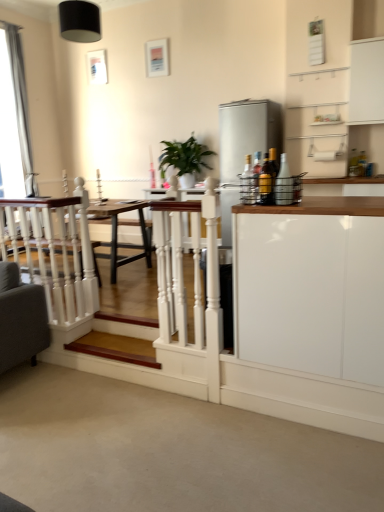
Question: Does satin silver refrigerator at right have a greater height compared to green glossy plant at center?

Choices:
 (A) no
 (B) yes

Answer: (B)

Question: Does satin silver refrigerator at right appear on the left side of green glossy plant at center?

Choices:
 (A) no
 (B) yes

Answer: (A)

Question: Does satin silver refrigerator at right have a lesser height compared to green glossy plant at center?

Choices:
 (A) no
 (B) yes

Answer: (A)

Question: Is satin silver refrigerator at right further to the viewer compared to green glossy plant at center?

Choices:
 (A) no
 (B) yes

Answer: (A)

Question: From a real-world perspective, is satin silver refrigerator at right beneath green glossy plant at center?

Choices:
 (A) yes
 (B) no

Answer: (B)

Question: From the image's perspective, is satin silver refrigerator at right under green glossy plant at center?

Choices:
 (A) no
 (B) yes

Answer: (B)

Question: Is satin silver refrigerator at right positioned before translucent glass bottle at right, acting as the third bottle starting from the left?

Choices:
 (A) yes
 (B) no

Answer: (B)

Question: Is satin silver refrigerator at right not near translucent glass bottle at right, acting as the third bottle starting from the left?

Choices:
 (A) no
 (B) yes

Answer: (B)

Question: Is satin silver refrigerator at right thinner than translucent glass bottle at right, acting as the third bottle starting from the left?

Choices:
 (A) yes
 (B) no

Answer: (B)

Question: From the image's perspective, is satin silver refrigerator at right over translucent glass bottle at right, the first bottle when ordered from right to left?

Choices:
 (A) no
 (B) yes

Answer: (B)

Question: Is satin silver refrigerator at right at the right side of translucent glass bottle at right, the first bottle when ordered from right to left?

Choices:
 (A) yes
 (B) no

Answer: (A)

Question: Does satin silver refrigerator at right have a greater width compared to translucent glass bottle at right, the first bottle when ordered from right to left?

Choices:
 (A) no
 (B) yes

Answer: (B)

Question: Is white glossy cabinet at right, marked as the 2th cabinetry in a top-to-bottom arrangement, not inside green glossy plant at center?

Choices:
 (A) yes
 (B) no

Answer: (A)